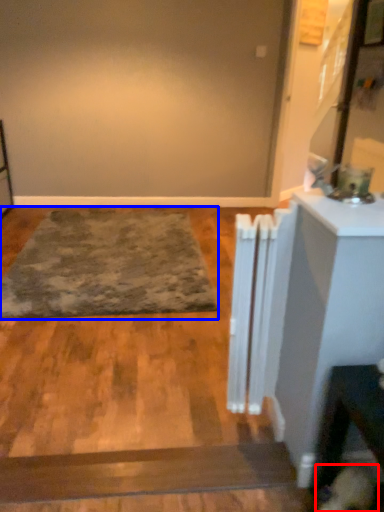
Question: Which object appears closest to the camera in this image, dog (highlighted by a red box) or mat (highlighted by a blue box)?

Choices:
 (A) dog
 (B) mat

Answer: (A)